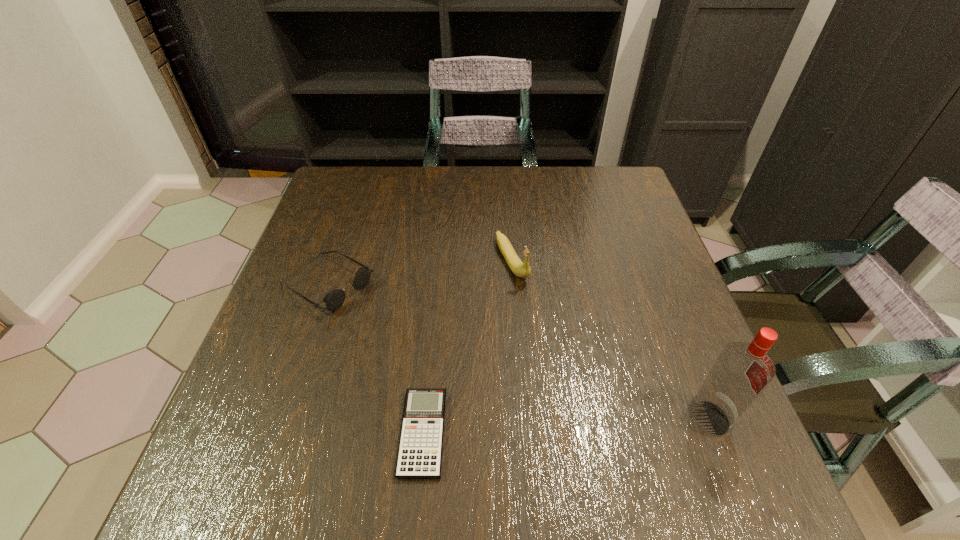
Identify the location of free space on the desktop that is between the third object from right to left and the rightmost object and is positioned on the front-facing side of the sunglasses. (564, 426).

This screenshot has width=960, height=540. In order to click on free space on the desktop that is between the calculator and the vodka and is positioned at the stem of the second tallest object in this screenshot , I will do `click(610, 423)`.